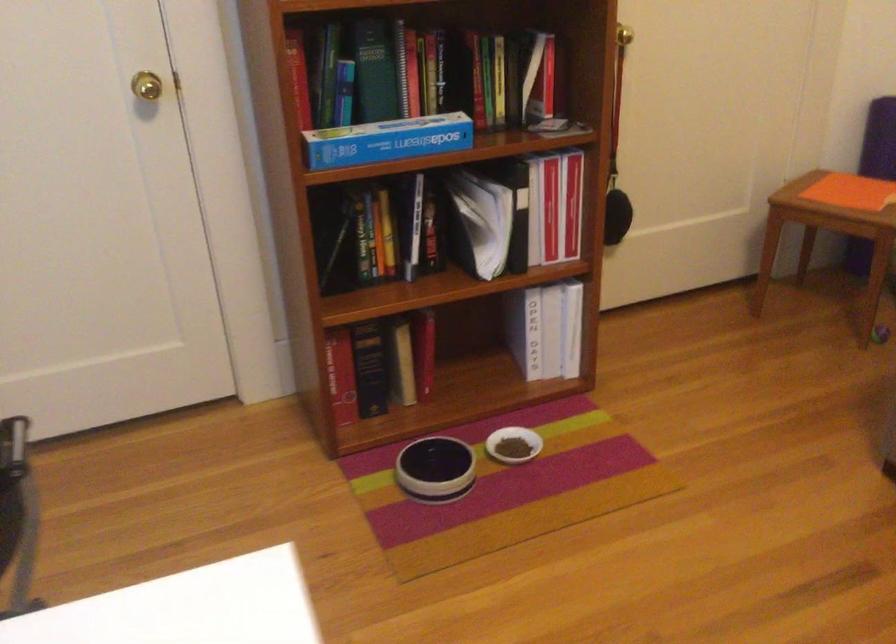
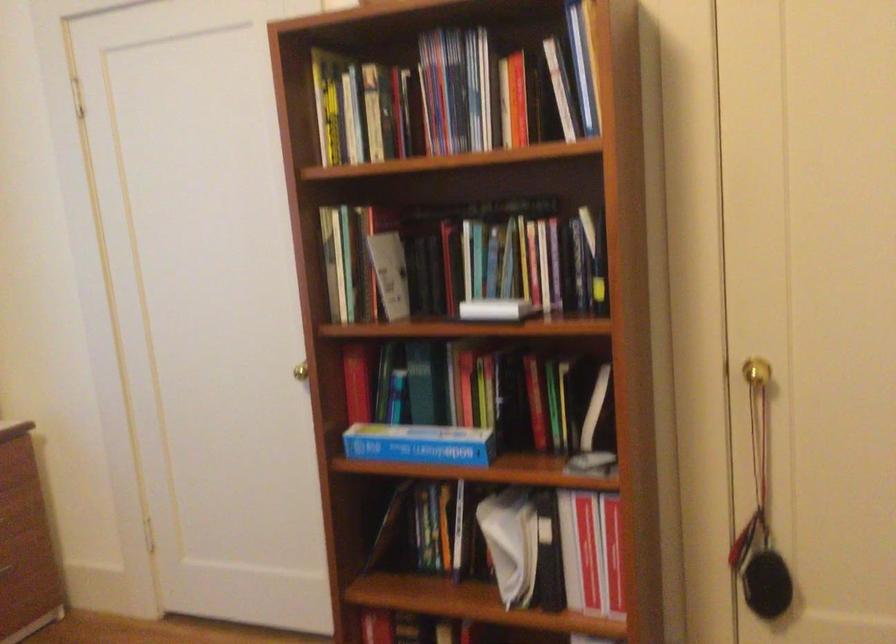
Locate, in the second image, the point that corresponds to (x=530, y=216) in the first image.

(570, 552)